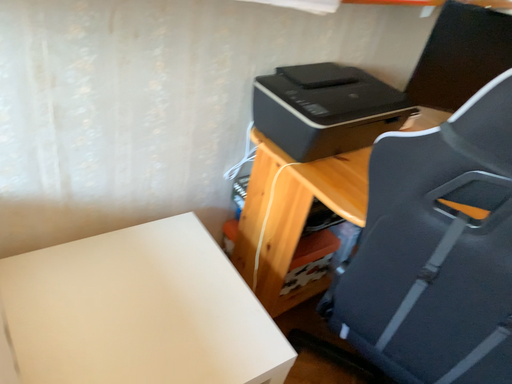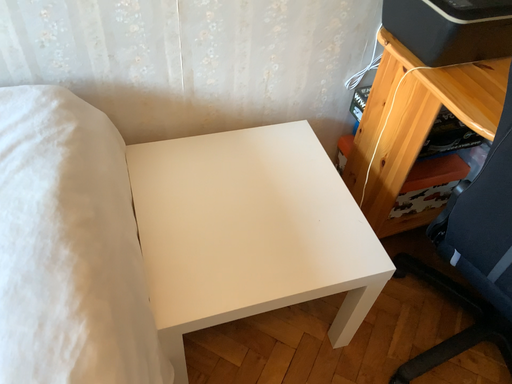
Question: Which way did the camera rotate in the video?

Choices:
 (A) rotated left
 (B) rotated right

Answer: (A)